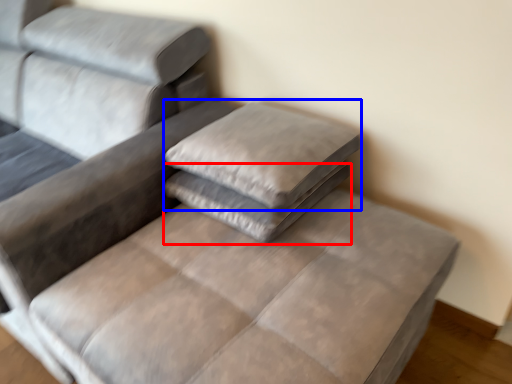
Question: Among these objects, which one is nearest to the camera, pillow (highlighted by a red box) or pillow (highlighted by a blue box)?

Choices:
 (A) pillow
 (B) pillow

Answer: (B)